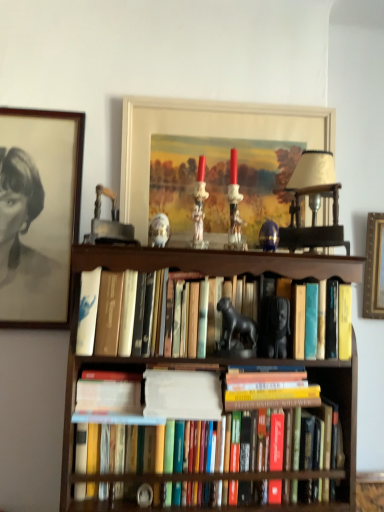
Question: Is matte black portrait at upper left, the 2th picture frame in the right-to-left sequence, not inside brown wooden bookcase at center?

Choices:
 (A) yes
 (B) no

Answer: (A)

Question: Can you confirm if matte black portrait at upper left, placed as the 1th picture frame when sorted from left to right, is shorter than brown wooden bookcase at center?

Choices:
 (A) no
 (B) yes

Answer: (B)

Question: Can you confirm if matte black portrait at upper left, the 2th picture frame in the right-to-left sequence, is wider than brown wooden bookcase at center?

Choices:
 (A) yes
 (B) no

Answer: (B)

Question: Does matte black portrait at upper left, the 2th picture frame in the right-to-left sequence, turn towards brown wooden bookcase at center?

Choices:
 (A) no
 (B) yes

Answer: (A)

Question: Is matte black portrait at upper left, the 2th picture frame in the right-to-left sequence, at the right side of brown wooden bookcase at center?

Choices:
 (A) no
 (B) yes

Answer: (A)

Question: Would you say matte black portrait at upper left, the 2th picture frame in the right-to-left sequence, is inside or outside matte beige lampshade at upper center?

Choices:
 (A) inside
 (B) outside

Answer: (B)

Question: In the image, is matte black portrait at upper left, the 2th picture frame in the right-to-left sequence, positioned in front of or behind matte beige lampshade at upper center?

Choices:
 (A) front
 (B) behind

Answer: (B)

Question: Does point (46, 161) appear closer or farther from the camera than point (334, 206)?

Choices:
 (A) farther
 (B) closer

Answer: (A)

Question: In the image, is matte black portrait at upper left, placed as the 1th picture frame when sorted from left to right, on the left side or the right side of matte beige lampshade at upper center?

Choices:
 (A) right
 (B) left

Answer: (B)

Question: Is hardcover books at center, which is the 4th book in top-to-bottom order, in front of or behind matte beige lampshade at upper center in the image?

Choices:
 (A) behind
 (B) front

Answer: (B)

Question: From a real-world perspective, is hardcover books at center, the first book in the bottom-to-top sequence, above or below matte beige lampshade at upper center?

Choices:
 (A) above
 (B) below

Answer: (B)

Question: Looking at the image, does hardcover books at center, which is the 4th book in top-to-bottom order, seem bigger or smaller compared to matte beige lampshade at upper center?

Choices:
 (A) big
 (B) small

Answer: (A)

Question: Considering the positions of hardcover books at center, which is the 4th book in top-to-bottom order, and matte beige lampshade at upper center in the image, is hardcover books at center, which is the 4th book in top-to-bottom order, wider or thinner than matte beige lampshade at upper center?

Choices:
 (A) wide
 (B) thin

Answer: (A)

Question: In terms of width, does porcelain figurine at center, the second animal positioned from the bottom, look wider or thinner when compared to matte white picture frame at upper center, the second picture frame when ordered from left to right?

Choices:
 (A) thin
 (B) wide

Answer: (B)

Question: Considering the positions of point (152, 233) and point (248, 137), is point (152, 233) closer or farther from the camera than point (248, 137)?

Choices:
 (A) farther
 (B) closer

Answer: (B)